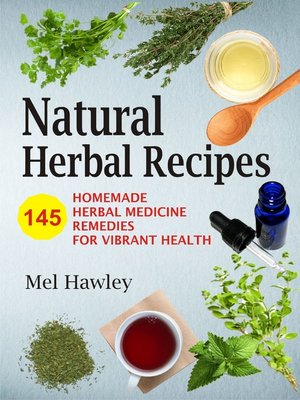
The height and width of the screenshot is (400, 300). Identify the location of book. (33, 256).